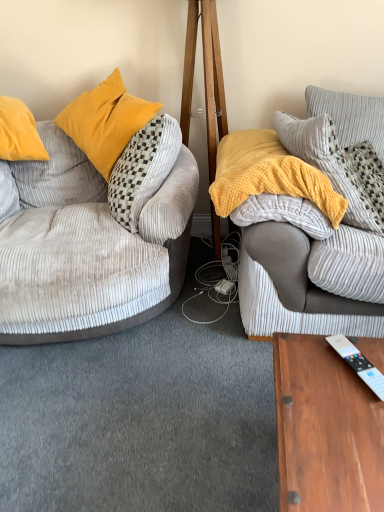
Question: From a real-world perspective, is soft gray corduroy couch at right, the second studio couch from the left, positioned under yellow textured blanket at center based on gravity?

Choices:
 (A) no
 (B) yes

Answer: (A)

Question: Is soft gray corduroy couch at right, the second studio couch from the left, facing away from yellow textured blanket at center?

Choices:
 (A) yes
 (B) no

Answer: (A)

Question: Is soft gray corduroy couch at right, the second studio couch from the left, not near yellow textured blanket at center?

Choices:
 (A) no
 (B) yes

Answer: (A)

Question: Can you confirm if soft gray corduroy couch at right, the second studio couch from the left, is positioned to the left of yellow textured blanket at center?

Choices:
 (A) no
 (B) yes

Answer: (A)

Question: From the image's perspective, does soft gray corduroy couch at right, marked as the 1th studio couch in a right-to-left arrangement, appear higher than yellow textured blanket at center?

Choices:
 (A) yes
 (B) no

Answer: (B)

Question: In terms of height, does corduroy pillow at upper right, the 1th pillow in the top-to-bottom sequence, look taller or shorter compared to white plastic remote control at lower right?

Choices:
 (A) tall
 (B) short

Answer: (A)

Question: From a real-world perspective, is corduroy pillow at upper right, the second pillow from the bottom, physically located above or below white plastic remote control at lower right?

Choices:
 (A) below
 (B) above

Answer: (B)

Question: Looking at their shapes, would you say corduroy pillow at upper right, the 1th pillow in the top-to-bottom sequence, is wider or thinner than white plastic remote control at lower right?

Choices:
 (A) wide
 (B) thin

Answer: (B)

Question: Considering their positions, is corduroy pillow at upper right, the 1th pillow in the top-to-bottom sequence, located in front of or behind white plastic remote control at lower right?

Choices:
 (A) behind
 (B) front

Answer: (A)

Question: Visually, is yellow textured blanket at center positioned to the left or to the right of corduroy pillow at upper right, the 1th pillow in the top-to-bottom sequence?

Choices:
 (A) right
 (B) left

Answer: (B)

Question: Is yellow textured blanket at center in front of or behind corduroy pillow at upper right, the 1th pillow in the top-to-bottom sequence, in the image?

Choices:
 (A) behind
 (B) front

Answer: (B)

Question: From the image's perspective, relative to corduroy pillow at upper right, the 1th pillow in the top-to-bottom sequence, is yellow textured blanket at center above or below?

Choices:
 (A) above
 (B) below

Answer: (B)

Question: In terms of size, does yellow textured blanket at center appear bigger or smaller than corduroy pillow at upper right, the 1th pillow in the top-to-bottom sequence?

Choices:
 (A) big
 (B) small

Answer: (A)

Question: Relative to velvet grey couch at left, the 2th studio couch in the right-to-left sequence, is white plastic remote control at lower right in front or behind?

Choices:
 (A) front
 (B) behind

Answer: (A)

Question: Looking at their shapes, would you say white plastic remote control at lower right is wider or thinner than velvet grey couch at left, which is the first studio couch from left to right?

Choices:
 (A) thin
 (B) wide

Answer: (A)